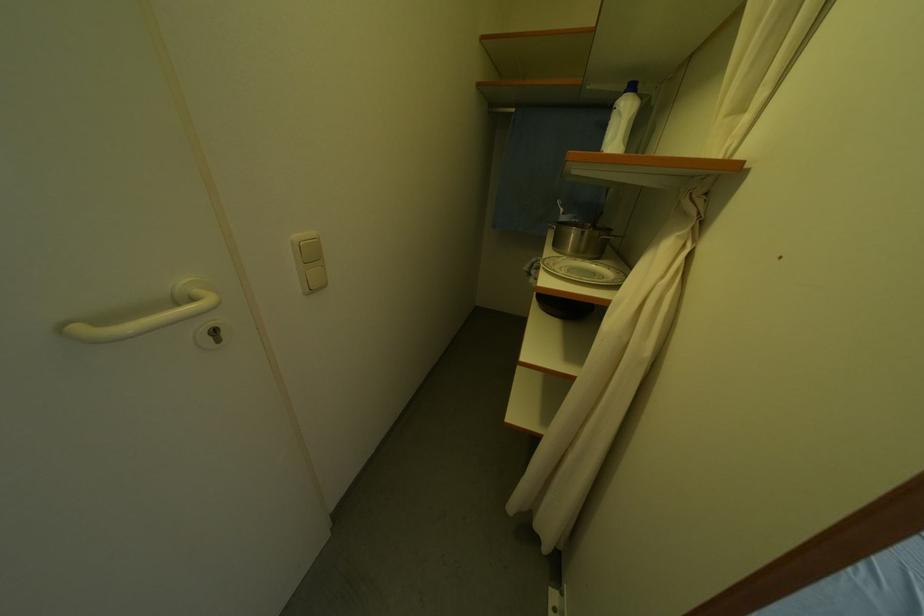
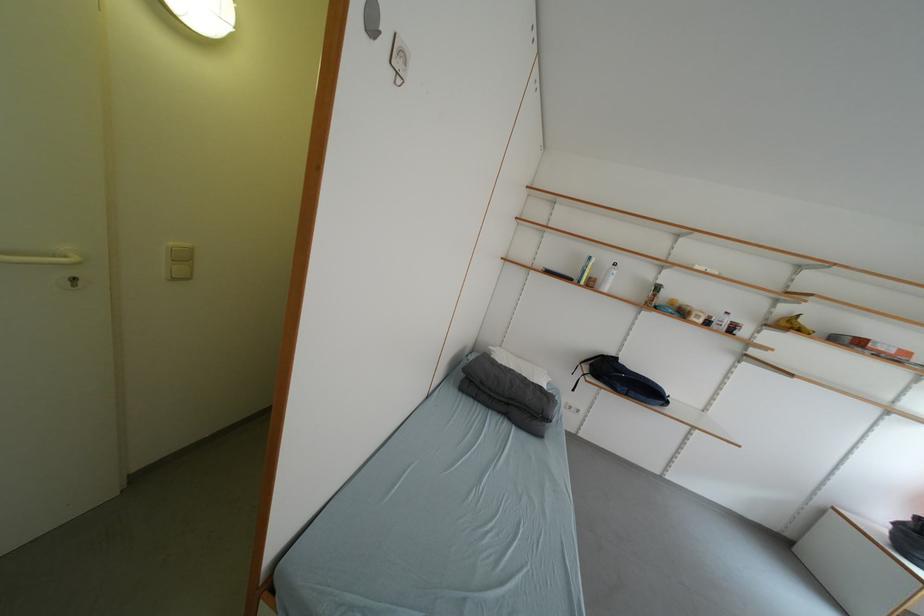
From the picture: What movement of the cameraman would produce the second image?

The cameraman moved toward right, backward.